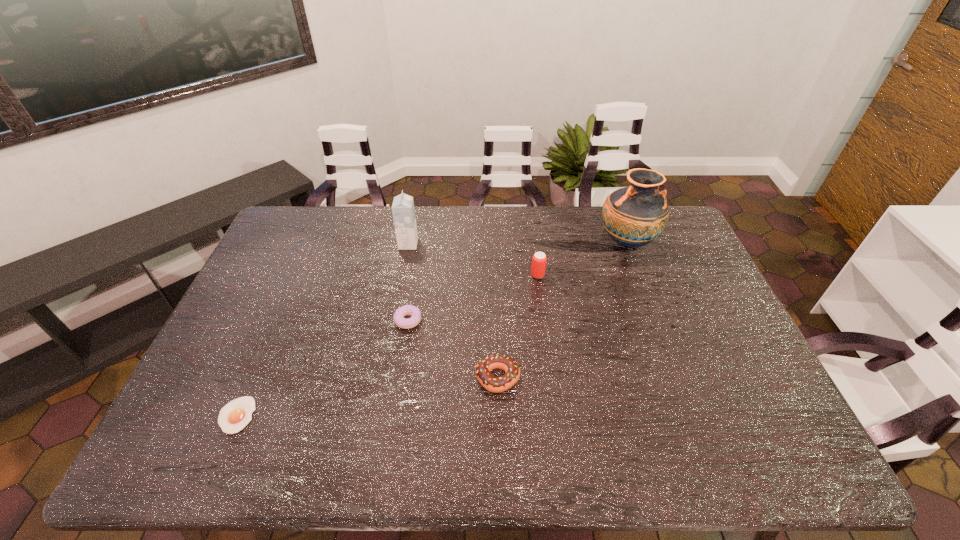
This screenshot has width=960, height=540. I want to click on object that is at the left edge, so click(234, 416).

Where is `object positioned at the right edge`? Image resolution: width=960 pixels, height=540 pixels. object positioned at the right edge is located at coordinates (633, 216).

Where is `object positioned at the near left corner`? object positioned at the near left corner is located at coordinates (234, 416).

Where is `object positioned at the far right corner`? object positioned at the far right corner is located at coordinates (633, 216).

At what (x,y) coordinates should I click in order to perform the action: click on free space at the far edge of the desktop. Please return your answer as a coordinate pair (x, y). The height and width of the screenshot is (540, 960). Looking at the image, I should click on (565, 227).

Where is `vacant space at the near edge of the desktop`? The image size is (960, 540). vacant space at the near edge of the desktop is located at coordinates (506, 468).

The image size is (960, 540). In the image, there is a desktop. Identify the location of vacant space at the left edge. (262, 303).

In the image, there is a desktop. Identify the location of free space at the right edge. This screenshot has width=960, height=540. (659, 253).

In the image, there is a desktop. Find the location of `vacant space at the far left corner`. vacant space at the far left corner is located at coordinates (284, 219).

In order to click on free spot at the near right corner of the desktop in this screenshot , I will do `click(743, 462)`.